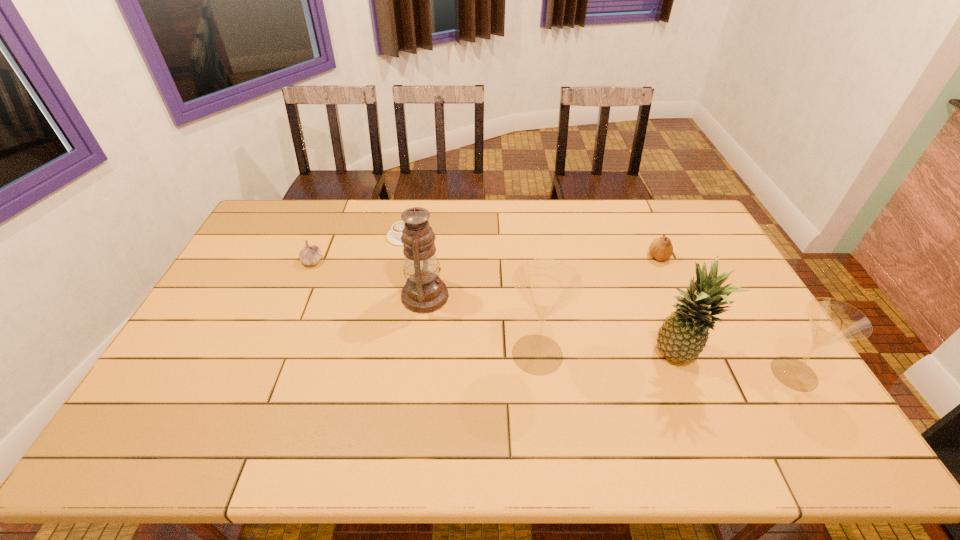
You are a GUI agent. You are given a task and a screenshot of the screen. Output one action in this format:
    pyautogui.click(x=<x>, y=<y>)
    Task: Click on the fourth object from left to right
    The width and height of the screenshot is (960, 540).
    Given the screenshot: What is the action you would take?
    pyautogui.click(x=547, y=285)

You are a GUI agent. You are given a task and a screenshot of the screen. Output one action in this format:
    pyautogui.click(x=<x>, y=<y>)
    Task: Click on the taller flute glass
    Image resolution: width=960 pixels, height=540 pixels.
    Given the screenshot: What is the action you would take?
    pyautogui.click(x=547, y=285)

This screenshot has height=540, width=960. I want to click on the right flute glass, so [x=832, y=321].

Locate an element on the screen. the fourth tallest object is located at coordinates [x=832, y=321].

Image resolution: width=960 pixels, height=540 pixels. I want to click on cappuccino, so click(x=394, y=235).

The image size is (960, 540). Identify the location of the shortest object. (394, 235).

This screenshot has width=960, height=540. I want to click on pear, so click(x=661, y=248).

Where is `oil lamp`? oil lamp is located at coordinates (424, 292).

Locate an element on the screen. The image size is (960, 540). the leftmost object is located at coordinates coord(310,255).

You are a GUI agent. You are given a task and a screenshot of the screen. Output one action in this format:
    pyautogui.click(x=<x>, y=<y>)
    Task: Click on the pineapple
    
    Given the screenshot: What is the action you would take?
    pyautogui.click(x=682, y=337)